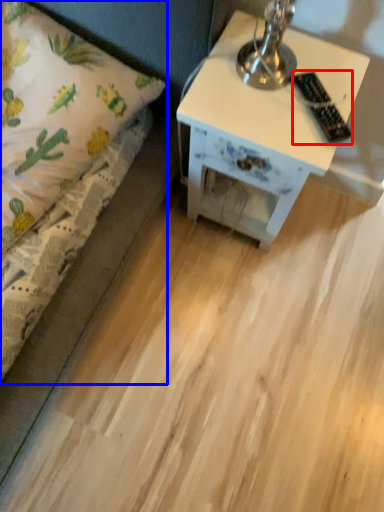
Question: Among these objects, which one is farthest to the camera, remote control (highlighted by a red box) or bed (highlighted by a blue box)?

Choices:
 (A) remote control
 (B) bed

Answer: (A)